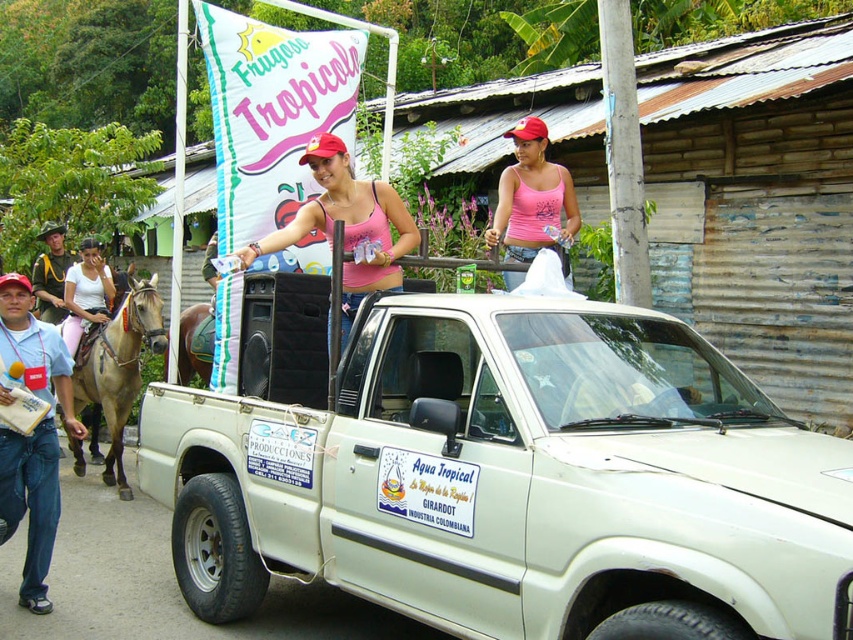
Question: Estimate the real-world distances between objects in this image. Which object is farther from the white matte shirt at left?

Choices:
 (A) blue denim jeans at lower left
 (B) brownsmoothhorse at left
 (C) white matte pickup truck at center

Answer: (C)

Question: Which point is closer to the camera?

Choices:
 (A) pink tank top at upper center
 (B) white matte pickup truck at center
 (C) pink fabric bikini top at center

Answer: (B)

Question: Does white matte pickup truck at center have a larger size compared to pink fabric bikini top at center?

Choices:
 (A) yes
 (B) no

Answer: (A)

Question: Is blue denim jeans at lower left further to the viewer compared to pink fabric bikini top at center?

Choices:
 (A) yes
 (B) no

Answer: (A)

Question: Can you confirm if pink tank top at upper center is wider than white matte shirt at left?

Choices:
 (A) yes
 (B) no

Answer: (A)

Question: Which point is closer to the camera?

Choices:
 (A) brownsmoothhorse at left
 (B) pink fabric bikini top at center
 (C) black uniform at left
 (D) blue denim jeans at lower left

Answer: (B)